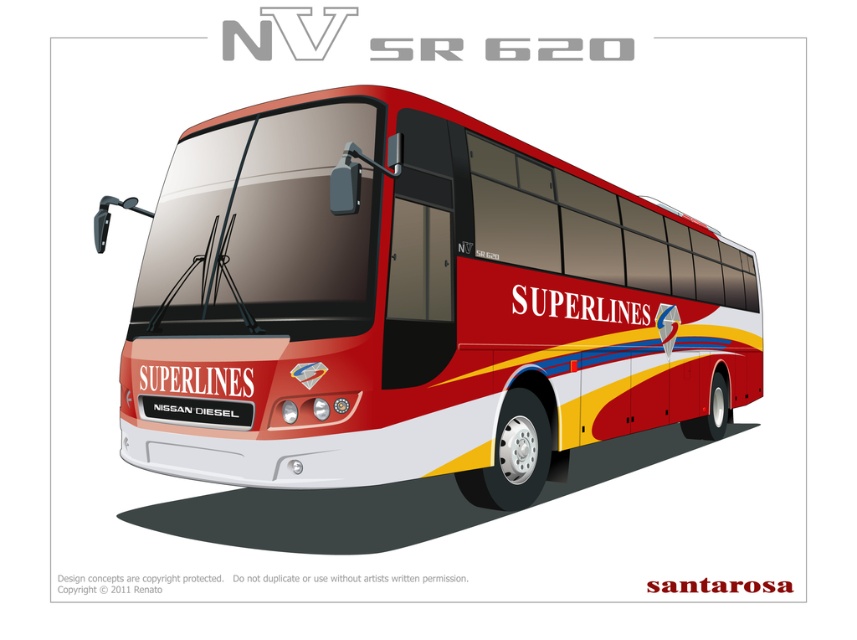
You are a bus inspector checking the NV SR 620 bus. You notice the shiny red bus at center and the matte black license plate at front. Which object is taller?

The shiny red bus at center is taller than the matte black license plate at front.

You are a pedestrian standing in front of the shiny red bus at center. You want to see the matte black license plate at front. Can you see it from your current position?

The matte black license plate at front is behind the shiny red bus at center, so you cannot see it from your current position in front of the bus.

Based on the provided scene description, what are the coordinates of the shiny red bus at center?

The shiny red bus at center is located at coordinates point (423, 305).